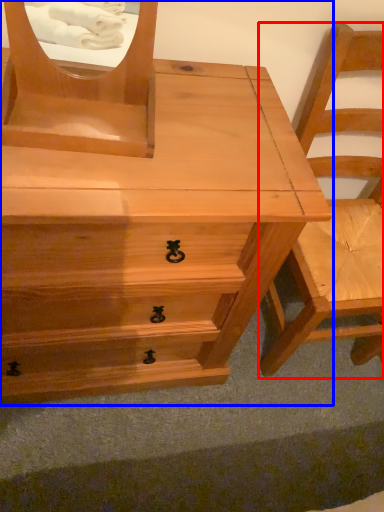
Question: Which of the following is the closest to the observer, chair (highlighted by a red box) or chest of drawers (highlighted by a blue box)?

Choices:
 (A) chair
 (B) chest of drawers

Answer: (B)